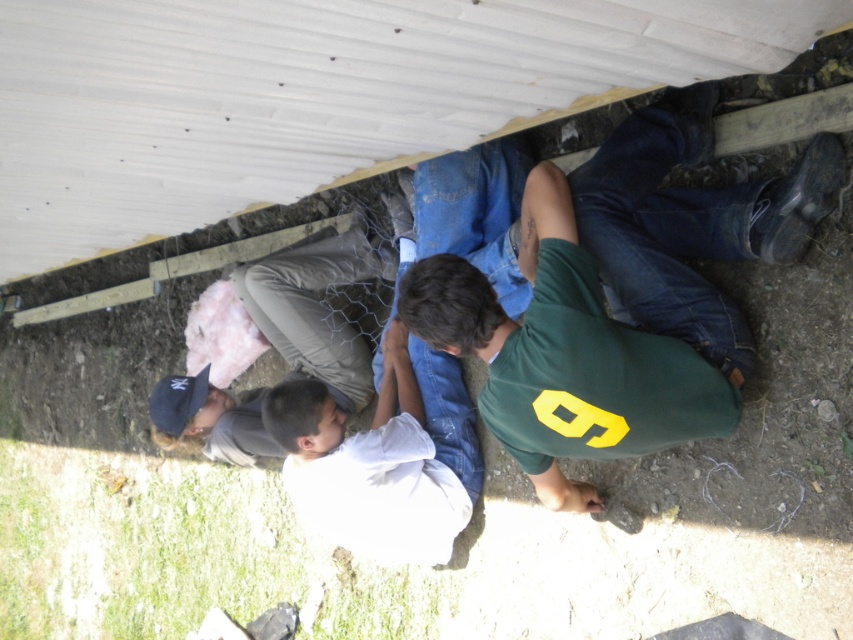
From the picture: Which is more to the right, green jersey at center or white cotton shirt at center?

green jersey at center

Based on the photo, is green jersey at center positioned at the back of white cotton shirt at center?

No, green jersey at center is in front of white cotton shirt at center.

Which is behind, point (560, 170) or point (399, 339)?

The point (399, 339) is behind.

Identify the location of green jersey at center. The width and height of the screenshot is (853, 640). (619, 296).